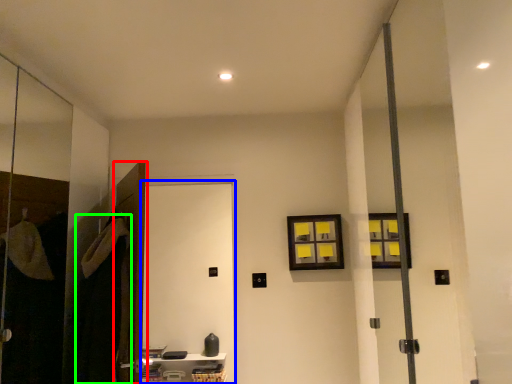
Question: Which is farther away from door (highlighted by a red box)? screen door (highlighted by a blue box) or robe (highlighted by a green box)?

Choices:
 (A) screen door
 (B) robe

Answer: (A)